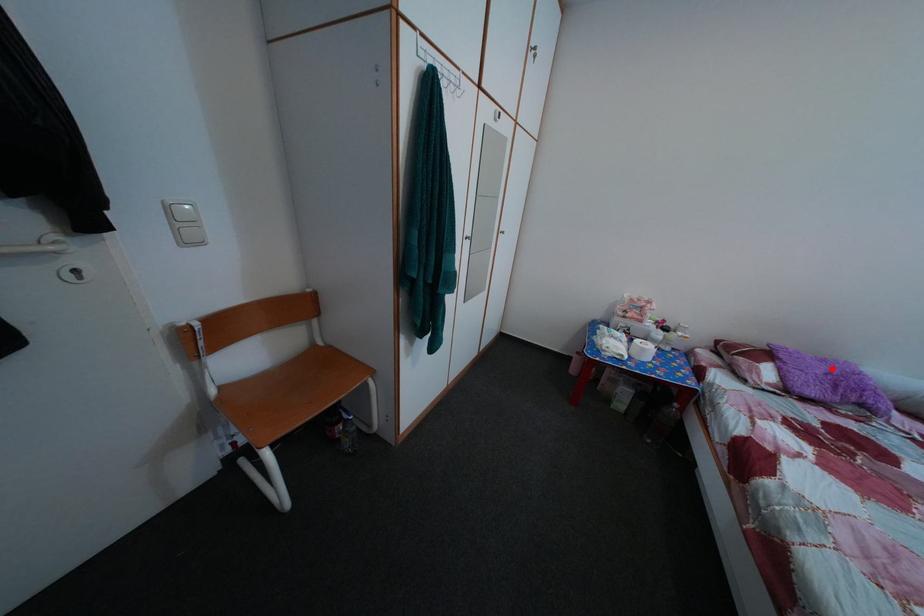
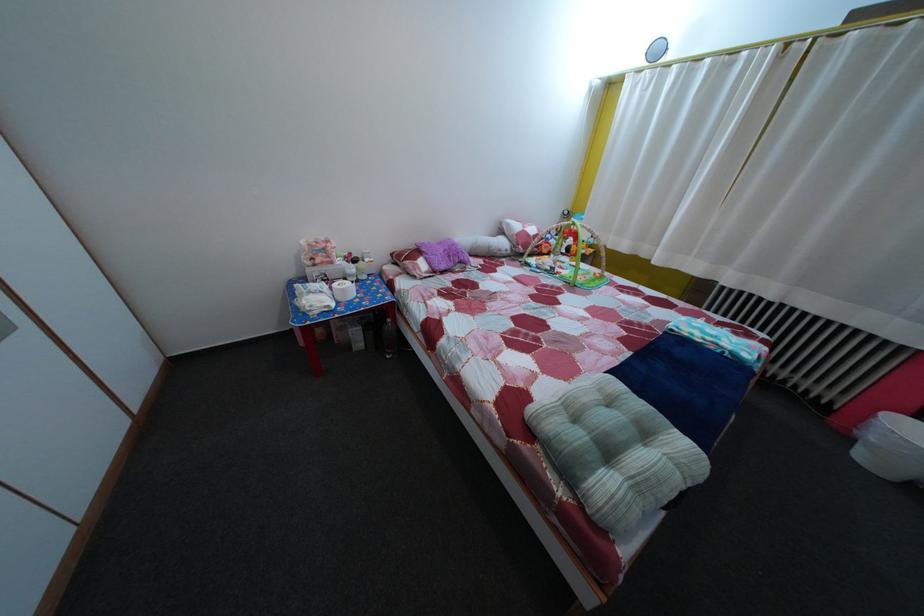
Question: I am providing you with two images of the same scene from different viewpoints. A red point is shown in image1. For the corresponding object point in image2, is it positioned nearer or farther from the camera?

Choices:
 (A) Nearer
 (B) Farther

Answer: (A)